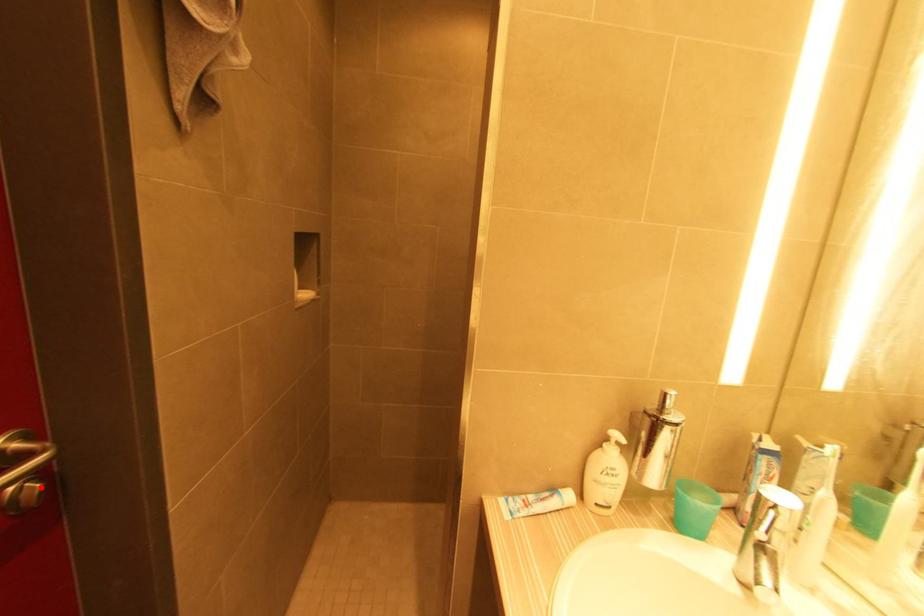
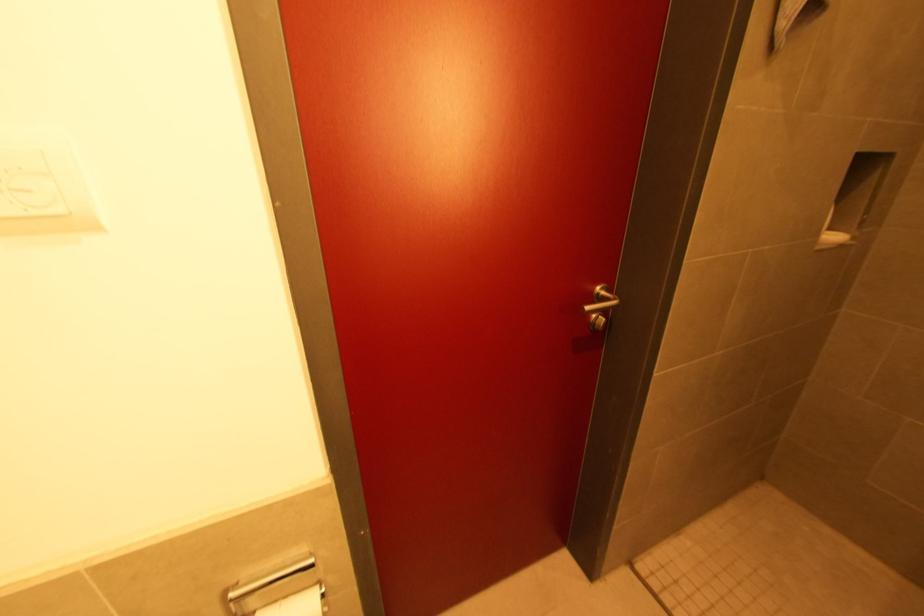
In the second image, find the point that corresponds to the highlighted location in the first image.

(606, 321)